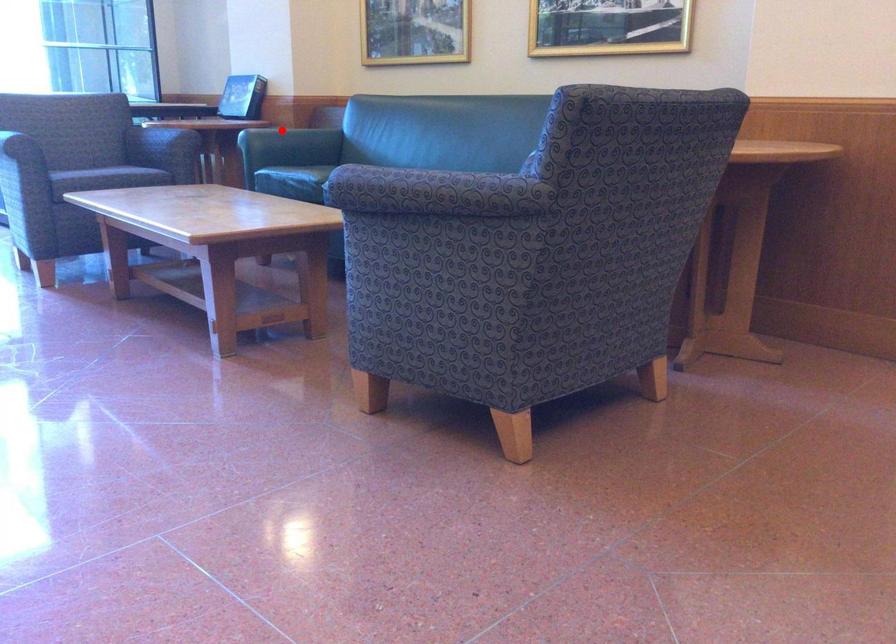
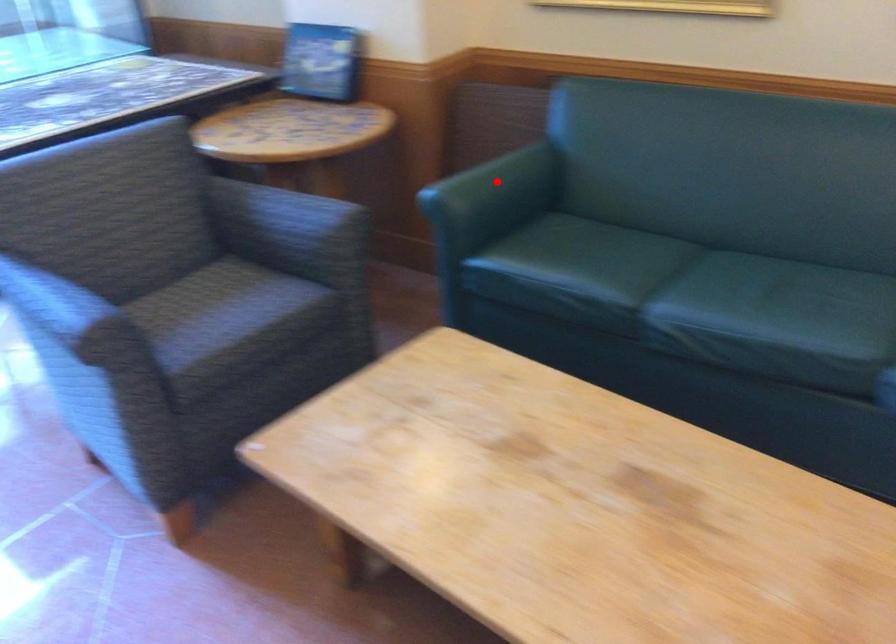
I am providing you with two images of the same scene from different viewpoints. A red point is marked on the first image and another point is marked on the second image. Is the red point in image1 aligned with the point shown in image2?

Yes